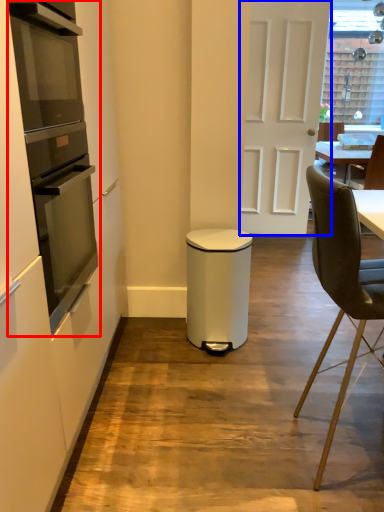
Question: Which of the following is the closest to the observer, kitchen appliance (highlighted by a red box) or door (highlighted by a blue box)?

Choices:
 (A) kitchen appliance
 (B) door

Answer: (A)